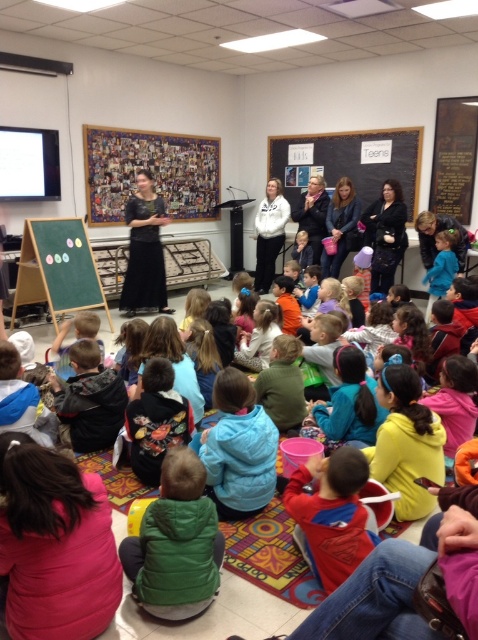
Can you confirm if green fuzzy vest at lower center is positioned to the right of black matte dress at center?

Correct, you'll find green fuzzy vest at lower center to the right of black matte dress at center.

Can you confirm if green fuzzy vest at lower center is bigger than black matte dress at center?

Actually, green fuzzy vest at lower center might be smaller than black matte dress at center.

Identify the location of green fuzzy vest at lower center. The image size is (478, 640). (175, 544).

Between blue fleece jacket at lower center and black chalkboard at upper center, which one is positioned lower?

blue fleece jacket at lower center

Between point (225, 432) and point (376, 164), which one is positioned behind?

Point (376, 164)

I want to click on blue fleece jacket at lower center, so click(238, 449).

Measure the distance between red fleece jacket at lower center and black matte dress at center.

red fleece jacket at lower center and black matte dress at center are 4.41 meters apart from each other.

Consider the image. Who is more forward, (324, 483) or (129, 305)?

Positioned in front is point (324, 483).

Between point (328, 518) and point (161, 214), which one is positioned in front?

Point (328, 518) is more forward.

This screenshot has width=478, height=640. What are the coordinates of `red fleece jacket at lower center` in the screenshot? It's located at (332, 513).